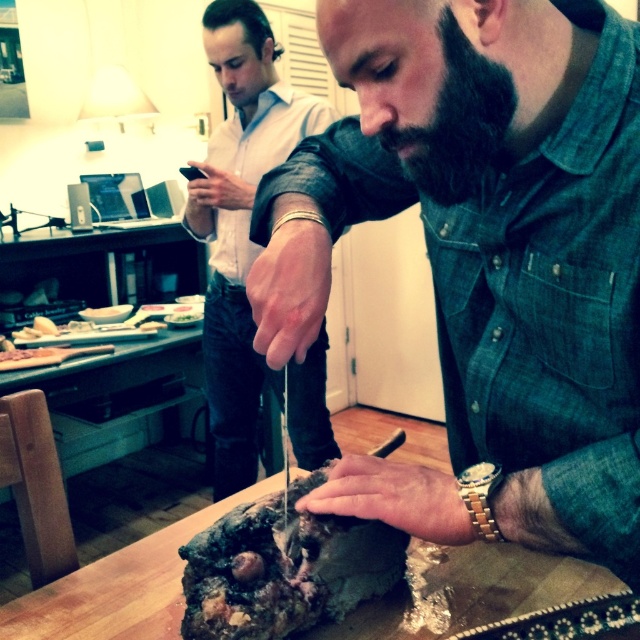
Is bearded man at center below black fuzzy beard at center?

Correct, bearded man at center is located below black fuzzy beard at center.

Who is more distant from viewer, (461, 252) or (460, 140)?

The point (461, 252) is behind.

This screenshot has width=640, height=640. What are the coordinates of `bearded man at center` in the screenshot? It's located at (484, 257).

Does wooden cutting board at center have a lesser width compared to black fuzzy beard at center?

Incorrect, wooden cutting board at center's width is not less than black fuzzy beard at center's.

Who is positioned more to the left, wooden cutting board at center or black fuzzy beard at center?

wooden cutting board at center

At what (x,y) coordinates should I click in order to perform the action: click on wooden cutting board at center. Please return your answer as a coordinate pair (x, y). Image resolution: width=640 pixels, height=640 pixels. Looking at the image, I should click on (118, 588).

Which of these two, matte black knife at center or wooden cutting board at center, stands taller?

Standing taller between the two is matte black knife at center.

Can you confirm if matte black knife at center is positioned to the right of wooden cutting board at center?

Incorrect, matte black knife at center is not on the right side of wooden cutting board at center.

This screenshot has height=640, width=640. What do you see at coordinates (240, 221) in the screenshot?
I see `matte black knife at center` at bounding box center [240, 221].

Locate an element on the screen. The image size is (640, 640). matte black knife at center is located at coordinates (240, 221).